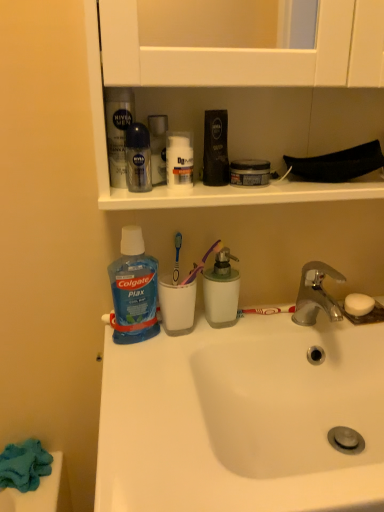
The height and width of the screenshot is (512, 384). Identify the location of vacant region to the right of blue translucent liquid at lower left. (211, 340).